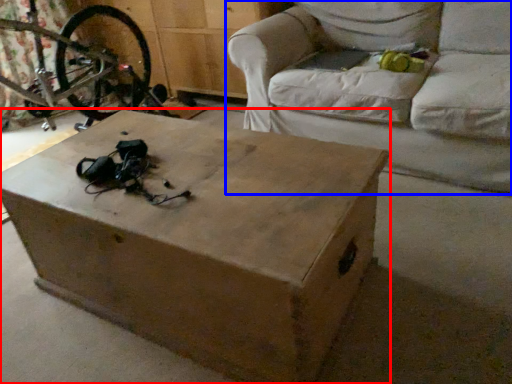
Question: Which point is further to the camera, table (highlighted by a red box) or studio couch (highlighted by a blue box)?

Choices:
 (A) table
 (B) studio couch

Answer: (B)